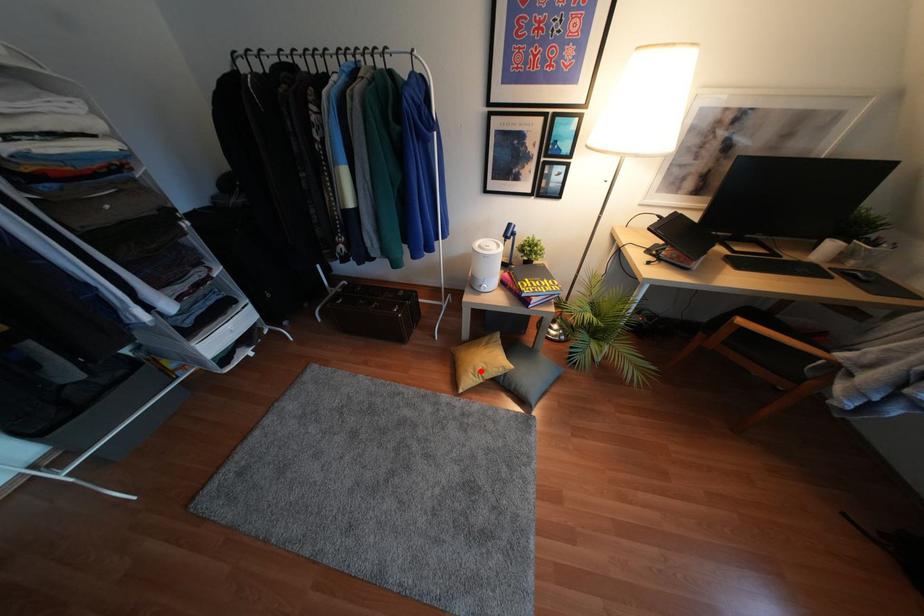
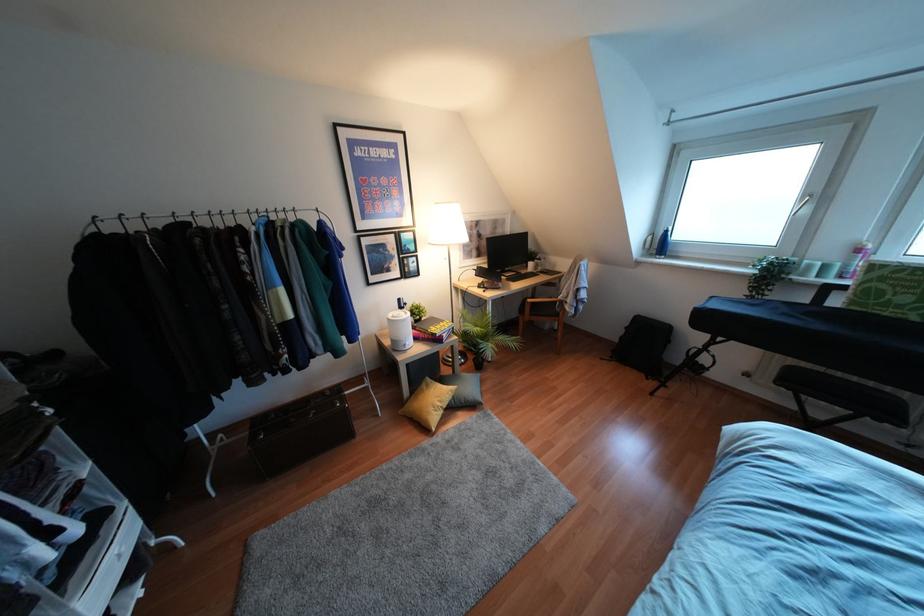
Question: A red point is marked in image1. In image2, is the corresponding 3D point closer to the camera or farther? Reply with the corresponding letter.

Choices:
 (A) The corresponding 3D point is closer.
 (B) The corresponding 3D point is farther.

Answer: (A)